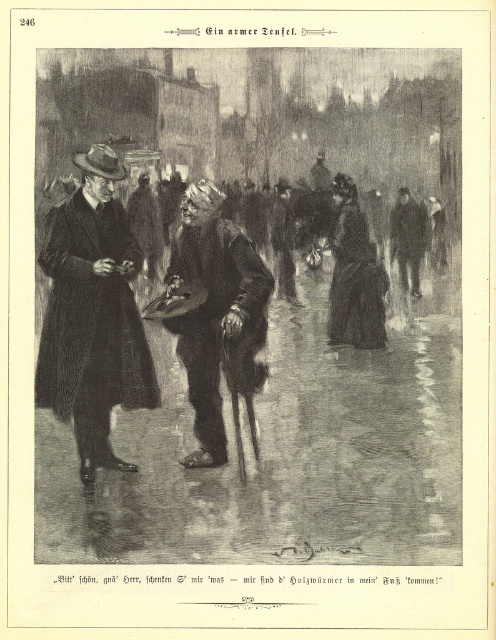
This screenshot has width=496, height=640. Describe the element at coordinates (93, 314) in the screenshot. I see `coarse wool coat at left` at that location.

Who is more forward, (75, 314) or (221, 273)?

Point (221, 273) is in front.

Image resolution: width=496 pixels, height=640 pixels. I want to click on coarse wool coat at left, so click(x=93, y=314).

Who is higher up, smooth black coat at center or coarse wool coat at left?

smooth black coat at center is higher up.

Is point (146, 90) positioned in front of point (83, 211)?

No, it is behind (83, 211).

Image resolution: width=496 pixels, height=640 pixels. Identify the location of smooth black coat at center. (248, 305).

Between point (417, 273) and point (172, 282), which one is positioned in front?

Point (172, 282) is in front.

Does smooth black coat at center have a greater width compared to dark gray wool hat at center?

Yes, smooth black coat at center is wider than dark gray wool hat at center.

Is point (62, 552) positioned after point (188, 376)?

That is False.

Locate an element on the screen. smooth black coat at center is located at coordinates (248, 305).